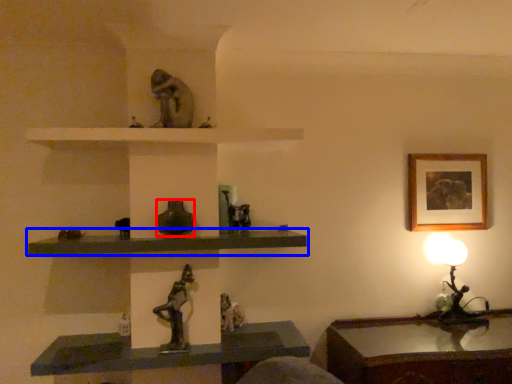
Question: Which object appears farthest to the camera in this image, glass vase (highlighted by a red box) or shelf (highlighted by a blue box)?

Choices:
 (A) glass vase
 (B) shelf

Answer: (A)